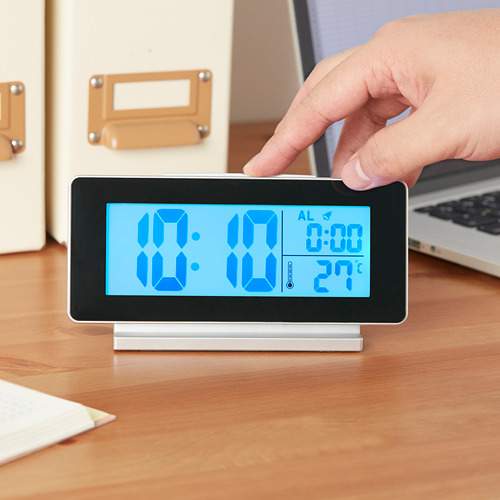
You are a GUI agent. You are given a task and a screenshot of the screen. Output one action in this format:
    pyautogui.click(x=<x>, y=<y>)
    Task: Click on the thermometer
    
    Given the screenshot: What is the action you would take?
    pyautogui.click(x=290, y=273)